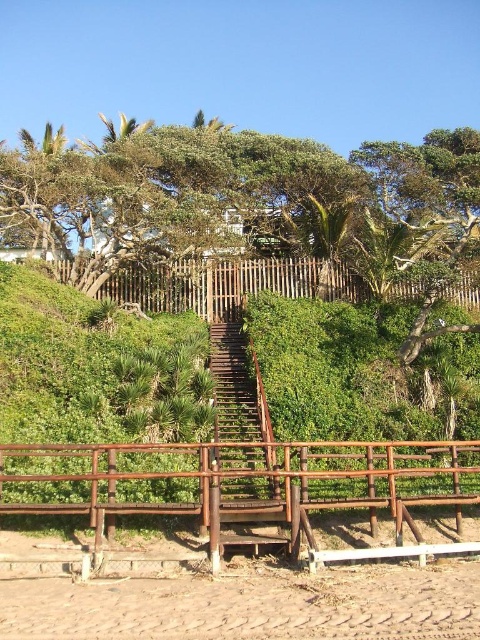
You are standing at the bottom of the hill and see the brown textured sand at lower center and the rusty metal stairs at center. Which object is located to the right of the other?

The brown textured sand at lower center is positioned on the right side of the rusty metal stairs at center.

You are standing at the bottom of the wooden staircase and looking up towards the green leafy tree at upper center and the rustic wood railing at center. Which object appears taller from your perspective?

The green leafy tree at upper center appears taller than the rustic wood railing at center from your perspective because it has a greater height compared to the rustic wood railing at center.

From the picture: You are planning to take a photo of the rusty metal stairs at center and the green leafy tree at upper center. Which object should you focus on first if you want to capture both in the frame without moving the camera?

The green leafy tree at upper center should be focused on first because its width is larger than the rusty metal stairs at center, so it will occupy more space in the frame.